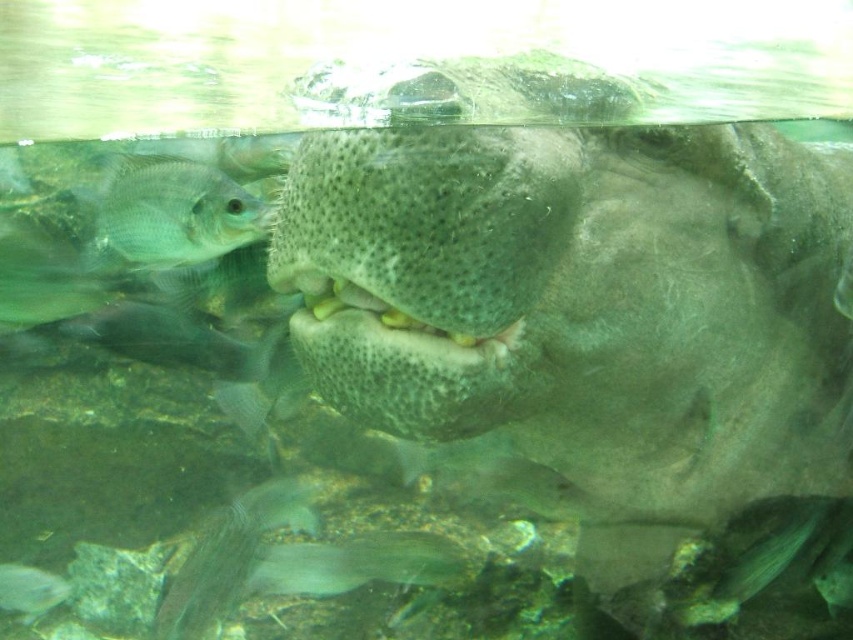
Question: Which point appears closest to the camera in this image?

Choices:
 (A) (267, 573)
 (B) (735, 572)
 (C) (390, 314)
 (D) (160, 230)

Answer: (C)

Question: Among these points, which one is nearest to the camera?

Choices:
 (A) (26, 582)
 (B) (795, 513)

Answer: (B)

Question: Does spongy greenish mouth at center appear under green matte fish at lower right?

Choices:
 (A) yes
 (B) no

Answer: (B)

Question: Is green matte fish at lower right positioned behind translucent gray fish at lower left?

Choices:
 (A) yes
 (B) no

Answer: (B)

Question: Can you confirm if green matte fish at upper left is thinner than translucent gray fish at lower center?

Choices:
 (A) no
 (B) yes

Answer: (B)

Question: Considering the real-world distances, which object is farthest from the translucent gray fish at lower left?

Choices:
 (A) translucent gray fish at lower center
 (B) green matte fish at lower right
 (C) spongy greenish mouth at center
 (D) green matte fish at upper left

Answer: (B)